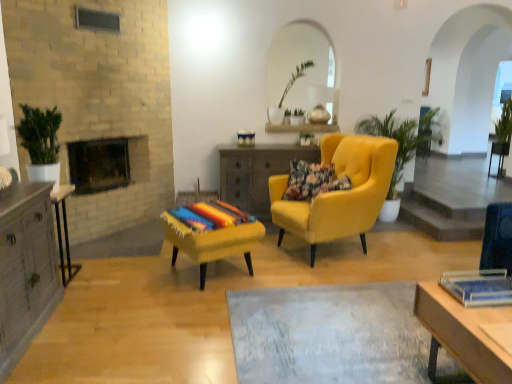
Question: Is wooden side table at center, the 1th table when ordered from back to front, next to yellow fabric armchair at center?

Choices:
 (A) yes
 (B) no

Answer: (B)

Question: From the image's perspective, does wooden side table at center, placed as the first table when sorted from right to left, appear lower than yellow fabric armchair at center?

Choices:
 (A) yes
 (B) no

Answer: (B)

Question: Is yellow fabric armchair at center completely or partially inside wooden side table at center, acting as the second table starting from the left?

Choices:
 (A) no
 (B) yes

Answer: (A)

Question: Can you confirm if wooden side table at center, placed as the first table when sorted from right to left, is positioned to the left of yellow fabric armchair at center?

Choices:
 (A) yes
 (B) no

Answer: (A)

Question: Does wooden side table at center, placed as the first table when sorted from right to left, have a lesser width compared to yellow fabric armchair at center?

Choices:
 (A) no
 (B) yes

Answer: (B)

Question: From the image's perspective, is green leafy plant at center, which is the third houseplant from left to right, located above or below brick fireplace at center-left?

Choices:
 (A) below
 (B) above

Answer: (B)

Question: Based on their positions, is green leafy plant at center, which appears as the first houseplant when viewed from the right, located to the left or right of brick fireplace at center-left?

Choices:
 (A) right
 (B) left

Answer: (A)

Question: Is green leafy plant at center, which is the third houseplant from left to right, spatially inside brick fireplace at center-left, or outside of it?

Choices:
 (A) outside
 (B) inside

Answer: (A)

Question: Considering their positions, is green leafy plant at center, which appears as the first houseplant when viewed from the right, located in front of or behind brick fireplace at center-left?

Choices:
 (A) front
 (B) behind

Answer: (B)

Question: Considering the relative positions of wooden cabinet at left, which is counted as the 1th table, starting from the left, and green glossy plant at left, which is the 1th houseplant in front-to-back order, in the image provided, is wooden cabinet at left, which is counted as the 1th table, starting from the left, to the left or to the right of green glossy plant at left, which is the 1th houseplant in front-to-back order,?

Choices:
 (A) right
 (B) left

Answer: (A)

Question: From a real-world perspective, is wooden cabinet at left, which is counted as the 1th table, starting from the left, above or below green glossy plant at left, which is the 1th houseplant from left to right?

Choices:
 (A) above
 (B) below

Answer: (B)

Question: Considering the positions of point (70, 264) and point (26, 140), is point (70, 264) closer or farther from the camera than point (26, 140)?

Choices:
 (A) farther
 (B) closer

Answer: (A)

Question: From the image's perspective, relative to green glossy plant at left, which is the 1th houseplant from left to right, is wooden cabinet at left, the 2th table when ordered from back to front, above or below?

Choices:
 (A) below
 (B) above

Answer: (A)

Question: In terms of width, does brick fireplace at center-left look wider or thinner when compared to green leafy plant at center, acting as the 2th houseplant starting from the back?

Choices:
 (A) thin
 (B) wide

Answer: (A)

Question: From a real-world perspective, is brick fireplace at center-left above or below green leafy plant at center, which appears as the first houseplant when viewed from the right?

Choices:
 (A) above
 (B) below

Answer: (A)